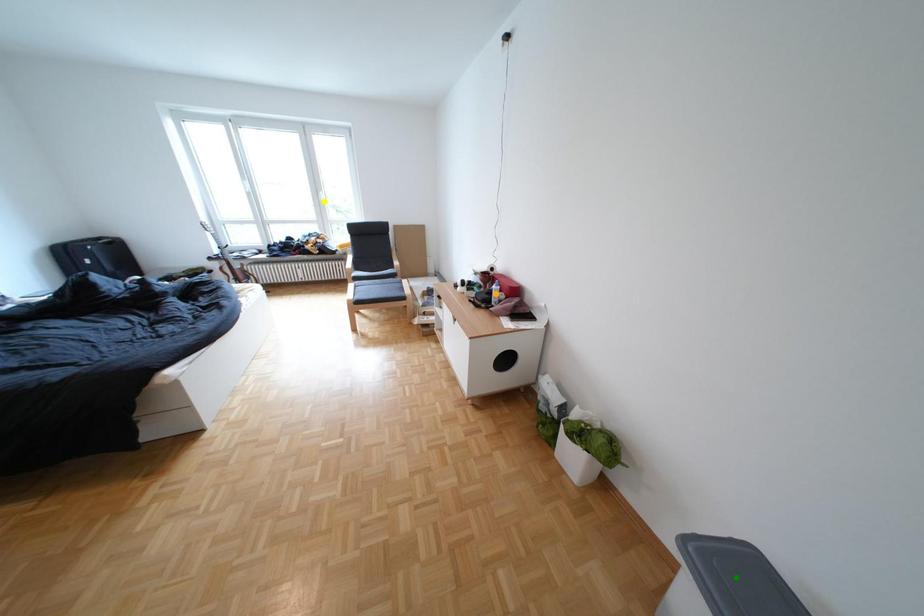
Order these from nearest to farthest:
yellow point, orange point, green point

yellow point → orange point → green point